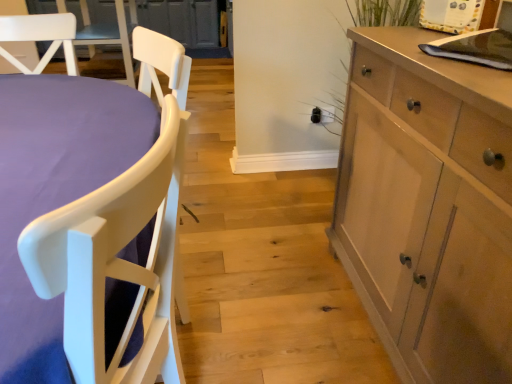
Question: Is white matte chair at left spatially inside light wood cabinet at right, or outside of it?

Choices:
 (A) outside
 (B) inside

Answer: (A)

Question: From their relative heights in the image, would you say white matte chair at left is taller or shorter than light wood cabinet at right?

Choices:
 (A) short
 (B) tall

Answer: (A)

Question: Is point (73, 289) positioned closer to the camera than point (394, 92)?

Choices:
 (A) farther
 (B) closer

Answer: (B)

Question: Is light wood cabinet at right bigger or smaller than white matte chair at left?

Choices:
 (A) small
 (B) big

Answer: (A)

Question: Considering their positions, is light wood cabinet at right located in front of or behind white matte chair at left?

Choices:
 (A) front
 (B) behind

Answer: (B)

Question: Is light wood cabinet at right spatially inside white matte chair at left, or outside of it?

Choices:
 (A) outside
 (B) inside

Answer: (A)

Question: Looking at their shapes, would you say light wood cabinet at right is wider or thinner than white matte chair at left?

Choices:
 (A) thin
 (B) wide

Answer: (A)